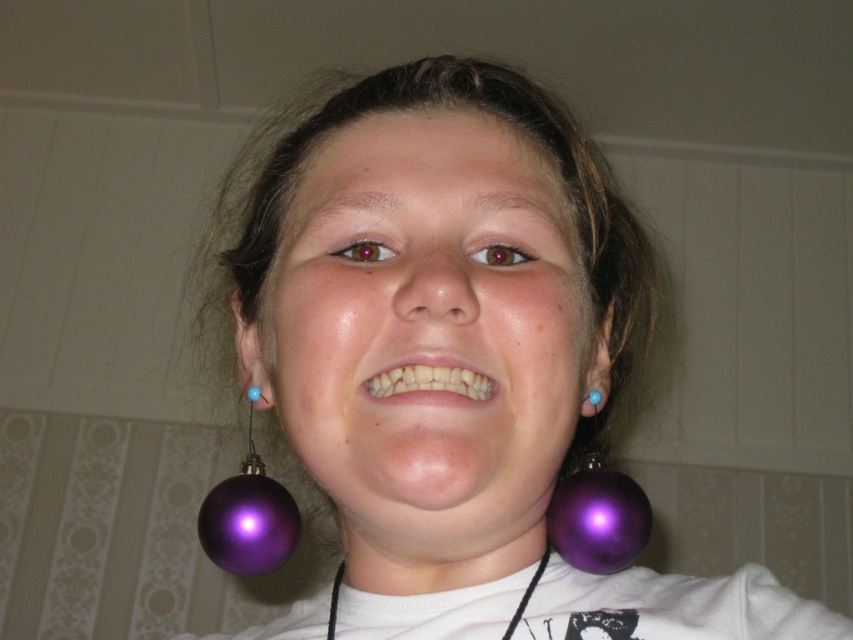
Based on the photo, please look at the image and locate the purple glossy ball at lower right. What are its coordinates in the image?

The purple glossy ball at lower right is located at coordinates point [596,515].

You are a jeweler examining two purple items in the image. The shiny purple earrings at center and the purple glossy ball at left. Which one is bigger?

The shiny purple earrings at center is larger in size than the purple glossy ball at left.

You are a photographer setting up a portrait session. The subject has shiny purple earrings at center and a purple glossy ball at left. You need to position a spotlight so that it can evenly illuminate both objects. Given their distance apart, will the spotlight with a 6 inch diameter beam be sufficient to cover both objects?

The distance between the shiny purple earrings at center and the purple glossy ball at left is 5.94 inches. Since the spotlight has a 6 inch diameter beam, it can cover both objects as the beam is slightly larger than the distance between them.